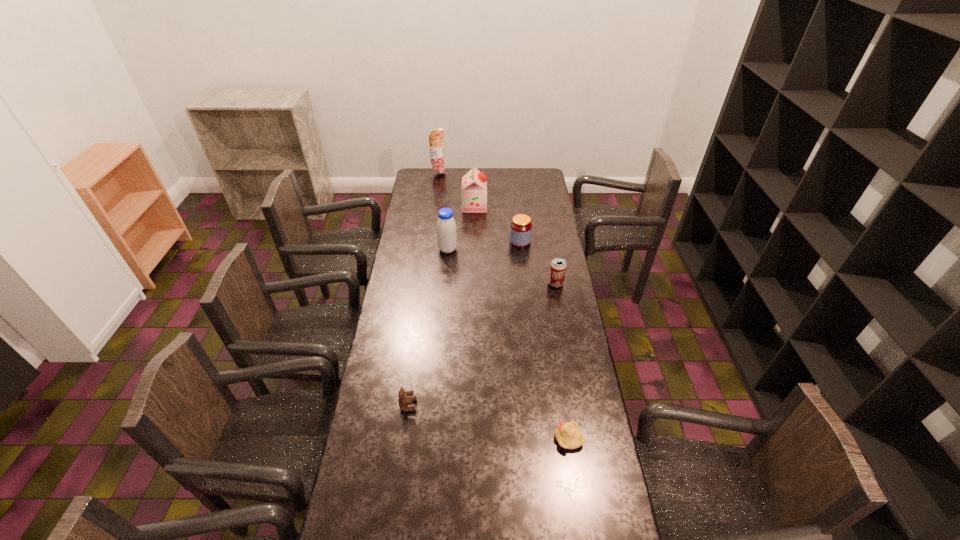
Where is `object that is positioned at the far edge`? object that is positioned at the far edge is located at coordinates (436, 146).

Locate an element on the screen. burrito that is positioned at the left edge is located at coordinates (436, 146).

Identify the location of teddy bear located at the left edge. The height and width of the screenshot is (540, 960). (403, 401).

This screenshot has height=540, width=960. In order to click on jar that is at the right edge in this screenshot , I will do `click(521, 226)`.

Identify the location of beer can that is at the right edge. The height and width of the screenshot is (540, 960). (558, 265).

The height and width of the screenshot is (540, 960). In order to click on duckling that is at the right edge in this screenshot , I will do `click(568, 436)`.

At what (x,y) coordinates should I click in order to perform the action: click on object present at the far left corner. Please return your answer as a coordinate pair (x, y). The height and width of the screenshot is (540, 960). Looking at the image, I should click on (436, 146).

I want to click on vacant space at the far edge of the desktop, so click(450, 171).

The width and height of the screenshot is (960, 540). In the image, there is a desktop. Identify the location of vacant space at the left edge. (395, 294).

Find the location of a particular element. The width and height of the screenshot is (960, 540). free space at the right edge is located at coordinates (572, 399).